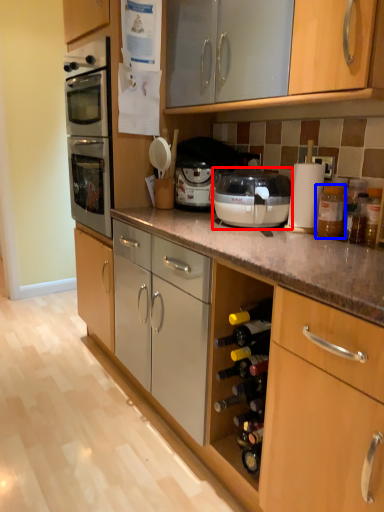
Question: Which of the following is the farthest to the observer, kitchen appliance (highlighted by a red box) or bottle (highlighted by a blue box)?

Choices:
 (A) kitchen appliance
 (B) bottle

Answer: (B)